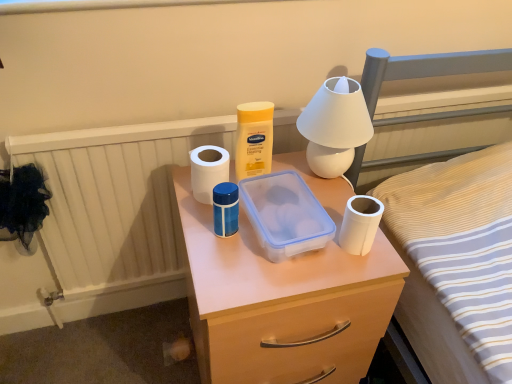
The image size is (512, 384). I want to click on free space in front of white matte toilet paper at right, the 2th toilet paper viewed from the left, so click(x=354, y=276).